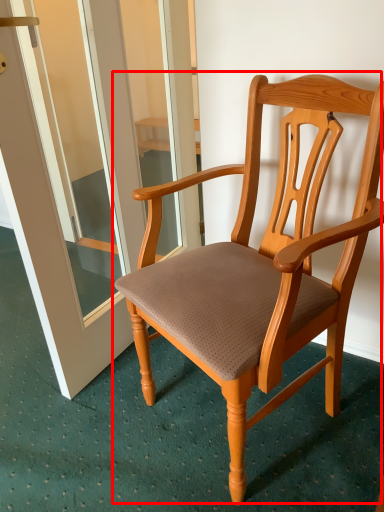
Question: From the image's perspective, what is the correct spatial relationship of chair (annotated by the red box) in relation to screen door?

Choices:
 (A) above
 (B) below

Answer: (B)